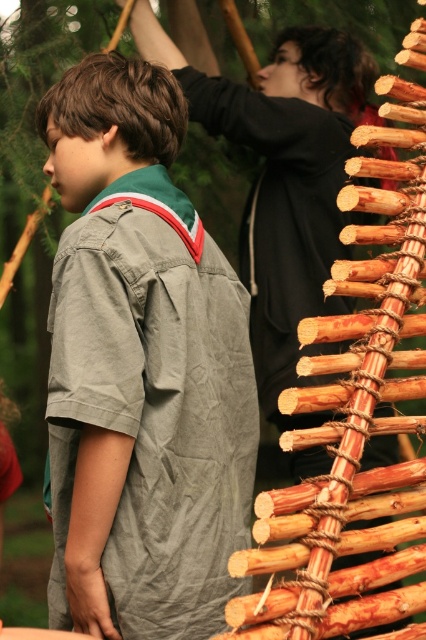
Question: Does gray cotton shirt at center have a lesser width compared to smooth black hoodie at upper center?

Choices:
 (A) no
 (B) yes

Answer: (B)

Question: Is gray cotton shirt at center below smooth black hoodie at upper center?

Choices:
 (A) yes
 (B) no

Answer: (A)

Question: Does gray cotton shirt at center have a larger size compared to smooth black hoodie at upper center?

Choices:
 (A) no
 (B) yes

Answer: (A)

Question: Among these objects, which one is farthest from the camera?

Choices:
 (A) smooth black hoodie at upper center
 (B) gray cotton shirt at center

Answer: (A)